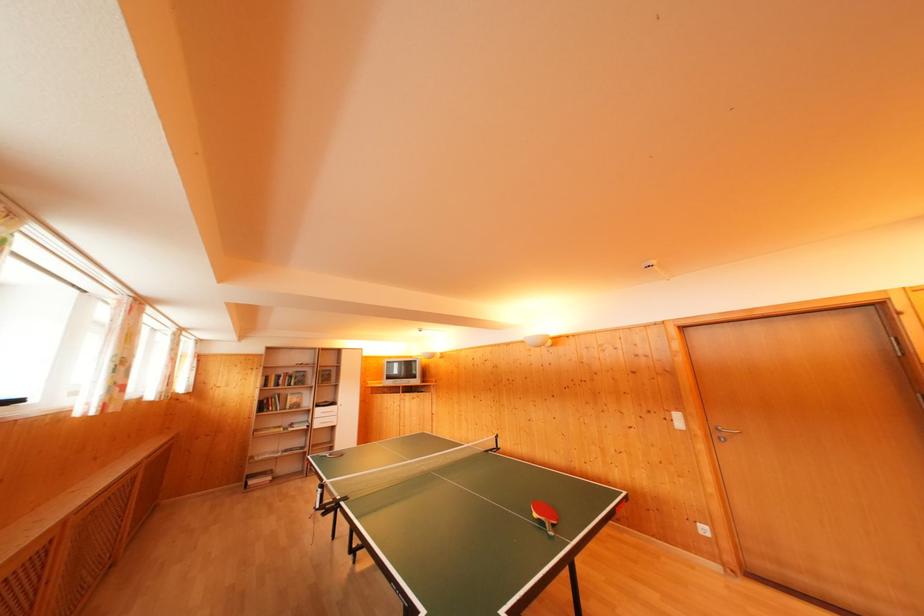
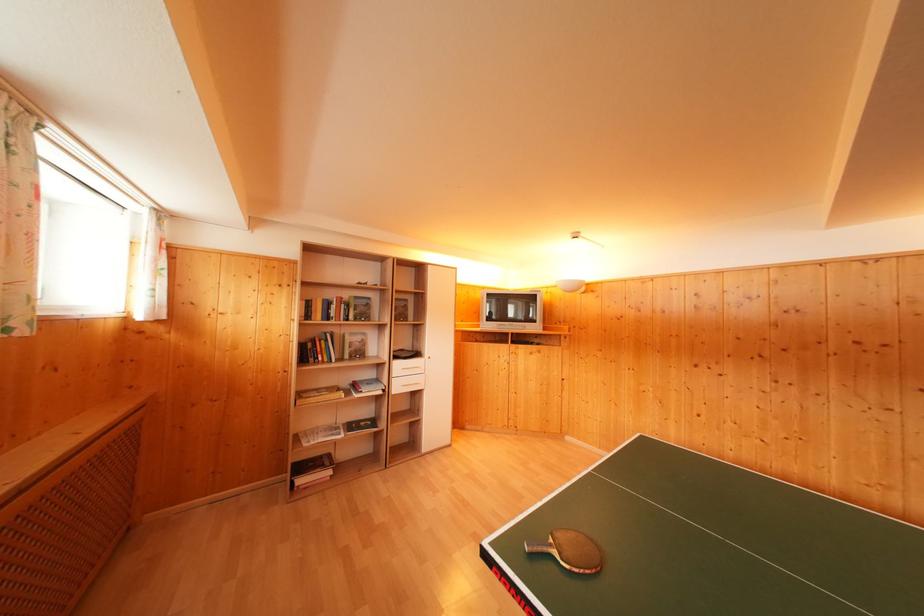
The point at (x=304, y=448) is marked in the first image. Where is the corresponding point in the second image?

(371, 416)